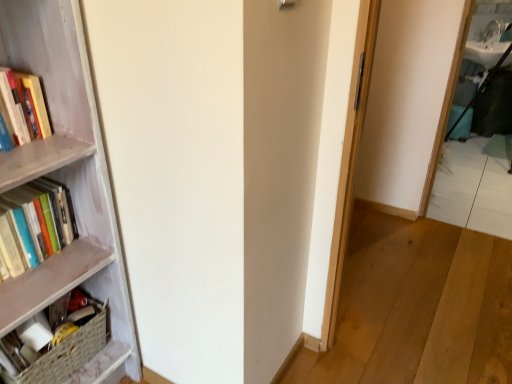
Question: Is woven basket at lower left, arranged as the first book when ordered from the bottom, in front of or behind hardcover books at left, the 2th book from the bottom, in the image?

Choices:
 (A) behind
 (B) front

Answer: (A)

Question: Choose the correct answer: Is woven basket at lower left, arranged as the first book when ordered from the bottom, inside hardcover books at left, the 2th book from the bottom, or outside it?

Choices:
 (A) inside
 (B) outside

Answer: (B)

Question: Which of these objects is positioned closest to the hardcover books at left, marked as the 1th book in a top-to-bottom arrangement?

Choices:
 (A) woven basket at lower left, arranged as the first book when ordered from the bottom
 (B) wooden bookcase at left

Answer: (B)

Question: Considering the real-world distances, which object is farthest from the wooden bookcase at left?

Choices:
 (A) hardcover books at left, the 2th book from the bottom
 (B) woven basket at lower left, arranged as the first book when ordered from the bottom

Answer: (B)